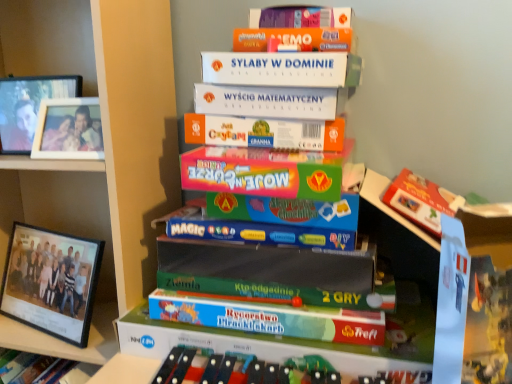
Question: From the image's perspective, does black plastic picture frame at left, which ranks as the 3th picture frame in top-to-bottom order, appear higher than green matte board game at center, arranged as the 1th book when viewed from the top?

Choices:
 (A) yes
 (B) no

Answer: (B)

Question: Can you confirm if black plastic picture frame at left, the 1th picture frame ordered from the bottom, is smaller than green matte board game at center, acting as the 2th book starting from the bottom?

Choices:
 (A) yes
 (B) no

Answer: (A)

Question: Can you confirm if black plastic picture frame at left, which ranks as the 3th picture frame in top-to-bottom order, is positioned to the right of green matte board game at center, arranged as the 1th book when viewed from the top?

Choices:
 (A) yes
 (B) no

Answer: (B)

Question: Can you confirm if black plastic picture frame at left, the 1th picture frame ordered from the bottom, is shorter than green matte board game at center, acting as the 2th book starting from the bottom?

Choices:
 (A) no
 (B) yes

Answer: (A)

Question: Is black plastic picture frame at left, the 1th picture frame ordered from the bottom, outside green matte board game at center, acting as the 2th book starting from the bottom?

Choices:
 (A) yes
 (B) no

Answer: (A)

Question: Is point (44, 279) closer or farther from the camera than point (338, 291)?

Choices:
 (A) farther
 (B) closer

Answer: (A)

Question: Is black plastic picture frame at left, the 1th picture frame ordered from the bottom, spatially inside green matte board game at center, acting as the 2th book starting from the bottom, or outside of it?

Choices:
 (A) outside
 (B) inside

Answer: (A)

Question: From the image's perspective, is black plastic picture frame at left, which ranks as the 3th picture frame in top-to-bottom order, above or below green matte board game at center, acting as the 2th book starting from the bottom?

Choices:
 (A) below
 (B) above

Answer: (A)

Question: From a real-world perspective, is black plastic picture frame at left, which ranks as the 3th picture frame in top-to-bottom order, physically located above or below green matte board game at center, acting as the 2th book starting from the bottom?

Choices:
 (A) below
 (B) above

Answer: (A)

Question: Considering the relative positions of white cardboard boxes at center and black plastic picture frame at left, which ranks as the 3th picture frame in top-to-bottom order, in the image provided, is white cardboard boxes at center to the left or to the right of black plastic picture frame at left, which ranks as the 3th picture frame in top-to-bottom order,?

Choices:
 (A) right
 (B) left

Answer: (B)

Question: Is point (110, 36) positioned closer to the camera than point (72, 238)?

Choices:
 (A) farther
 (B) closer

Answer: (B)

Question: From their relative heights in the image, would you say white cardboard boxes at center is taller or shorter than black plastic picture frame at left, the 1th picture frame ordered from the bottom?

Choices:
 (A) tall
 (B) short

Answer: (A)

Question: From a real-world perspective, is white cardboard boxes at center physically located above or below black plastic picture frame at left, the 1th picture frame ordered from the bottom?

Choices:
 (A) above
 (B) below

Answer: (A)

Question: Considering the positions of green matte board game at center, arranged as the 1th book when viewed from the top, and matte plastic game at center, which is the 2th book from top to bottom, in the image, is green matte board game at center, arranged as the 1th book when viewed from the top, wider or thinner than matte plastic game at center, which is the 2th book from top to bottom,?

Choices:
 (A) wide
 (B) thin

Answer: (A)

Question: Does point (275, 215) appear closer or farther from the camera than point (286, 380)?

Choices:
 (A) farther
 (B) closer

Answer: (A)